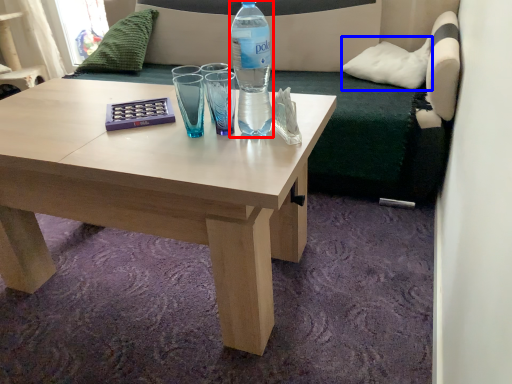
Question: Which object is closer to the camera taking this photo, bottle (highlighted by a red box) or pillow (highlighted by a blue box)?

Choices:
 (A) bottle
 (B) pillow

Answer: (A)